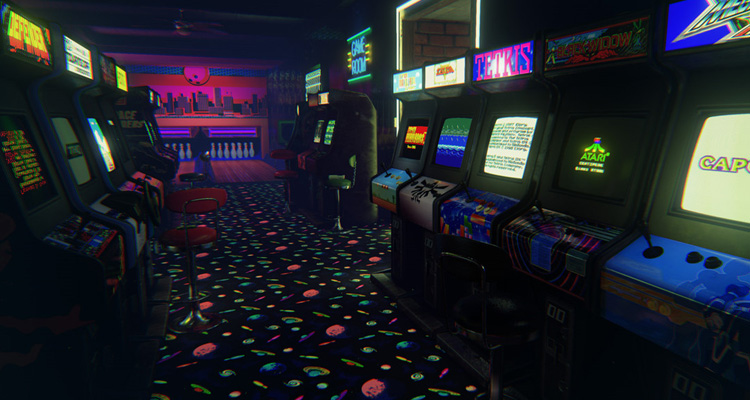
Find the location of a particular element. carpet is located at coordinates (349, 347).